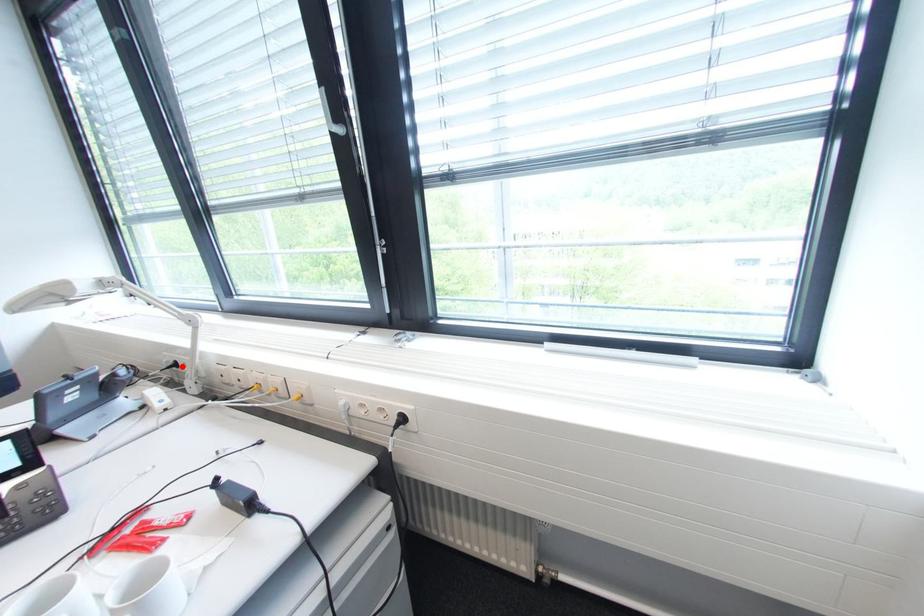
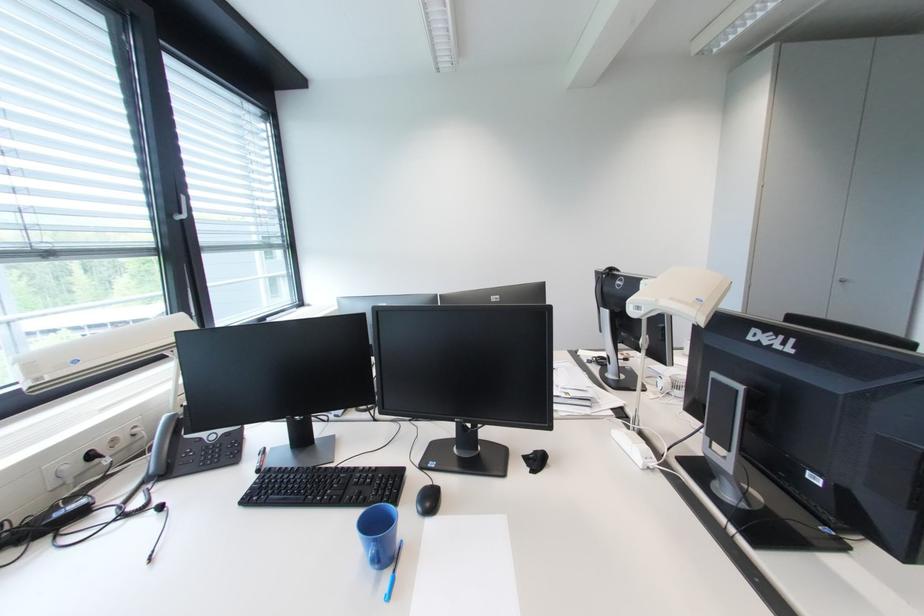
Where in the second image is the point corresponding to the highlighted location from the first image?

(98, 458)